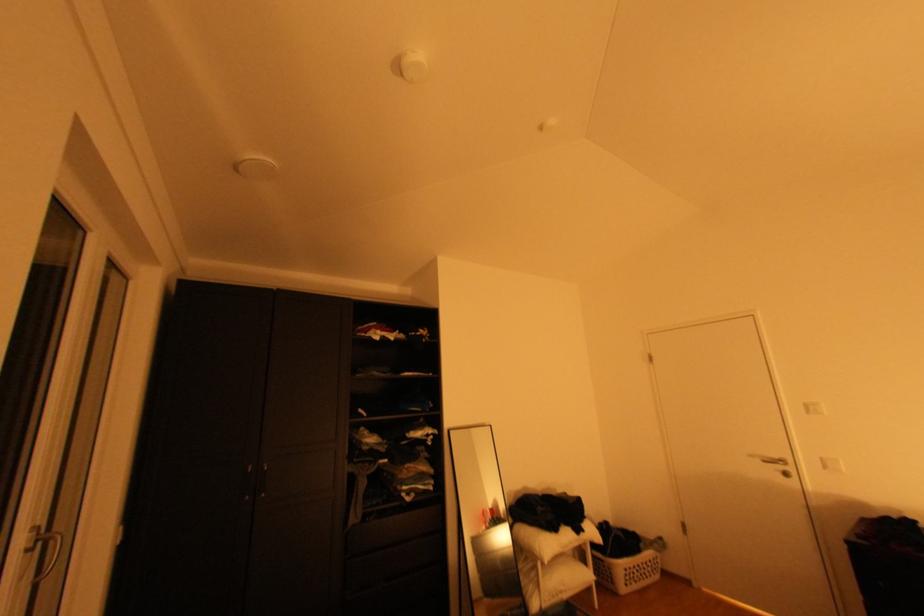
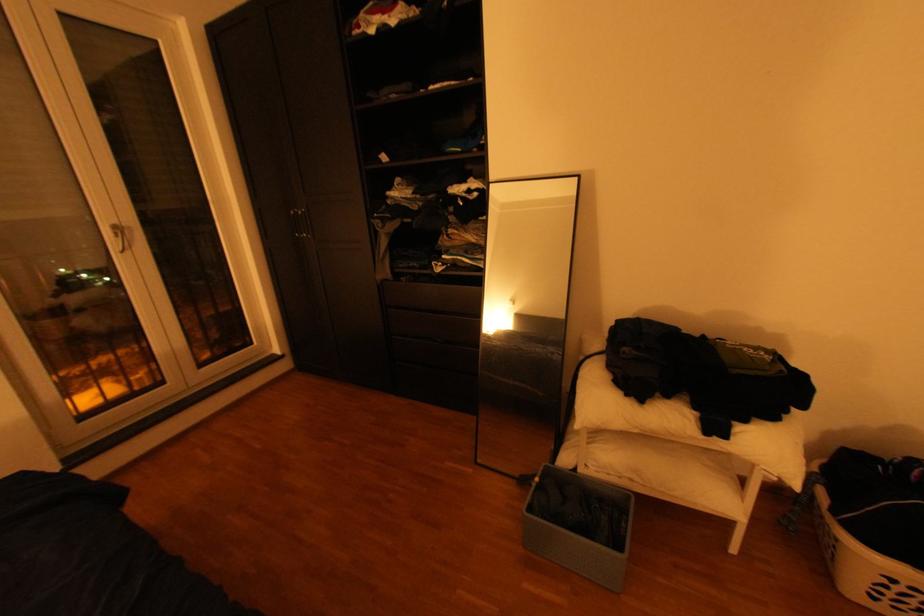
The point at (592, 531) is marked in the first image. Where is the corresponding point in the second image?

(735, 436)